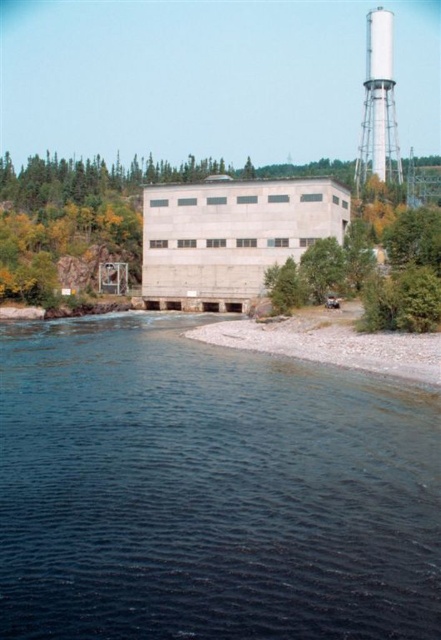
Based on the photo, you are a construction worker assessing the site for safety. You notice the smooth gravel shoreline at lower right and the white smooth water tower at upper right. Which of these two objects has a lower height?

The smooth gravel shoreline at lower right has a lesser height compared to the white smooth water tower at upper right.

You are standing at the center of the image and want to walk to the smooth gravel shoreline at lower right. Which direction should you move to reach it?

You should move to the right and downward from your current position at the center to reach the smooth gravel shoreline at lower right, as its coordinates are at point (x=331, y=342).